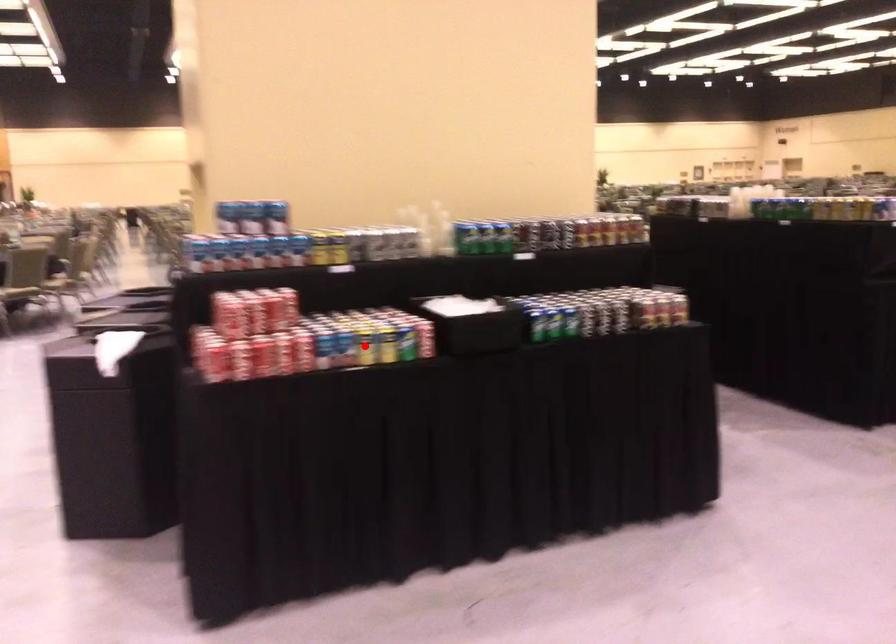
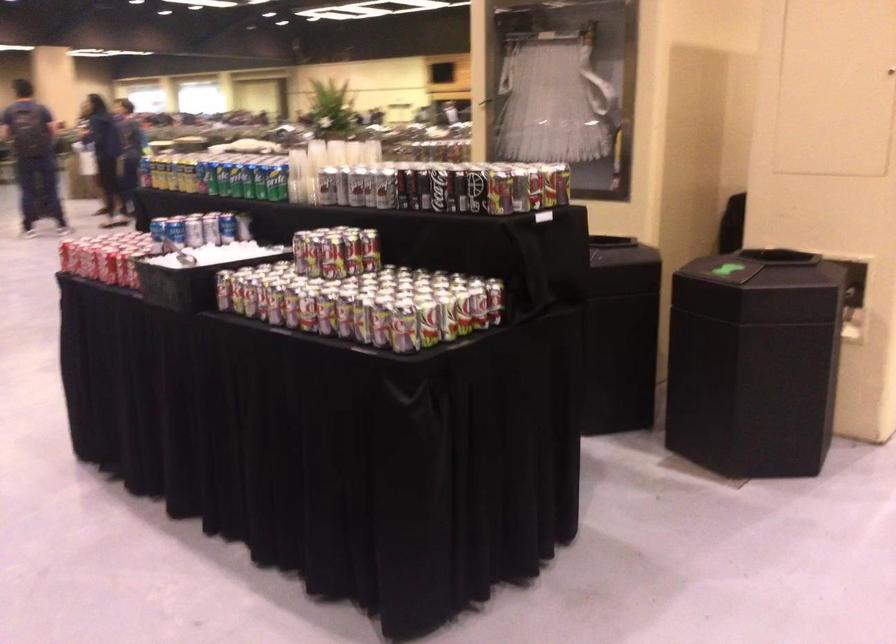
Question: I am providing you with two images of the same scene from different viewpoints. A red point is marked on the first image. Can you still see the location of the red point in image 2?

Choices:
 (A) Yes
 (B) No

Answer: (B)